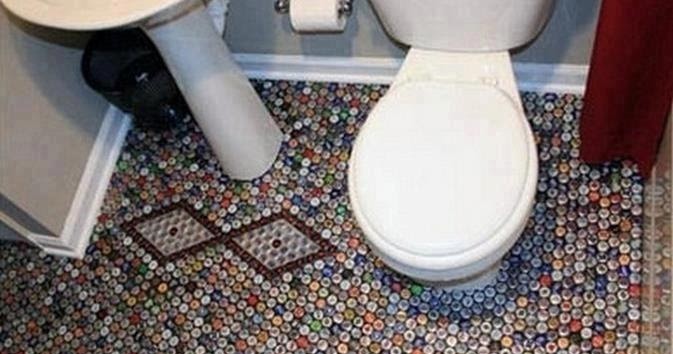
I want to click on toilet lid, so click(439, 166).